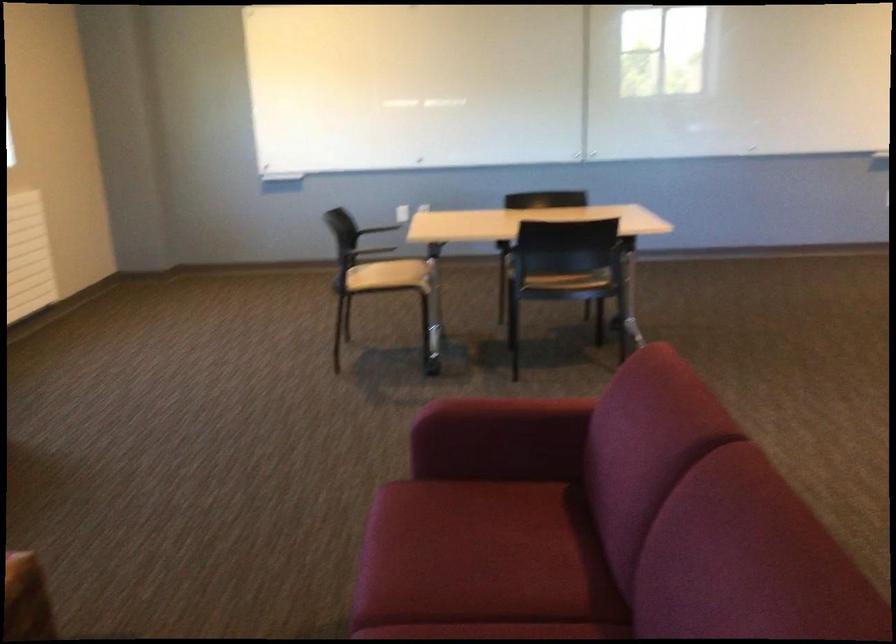
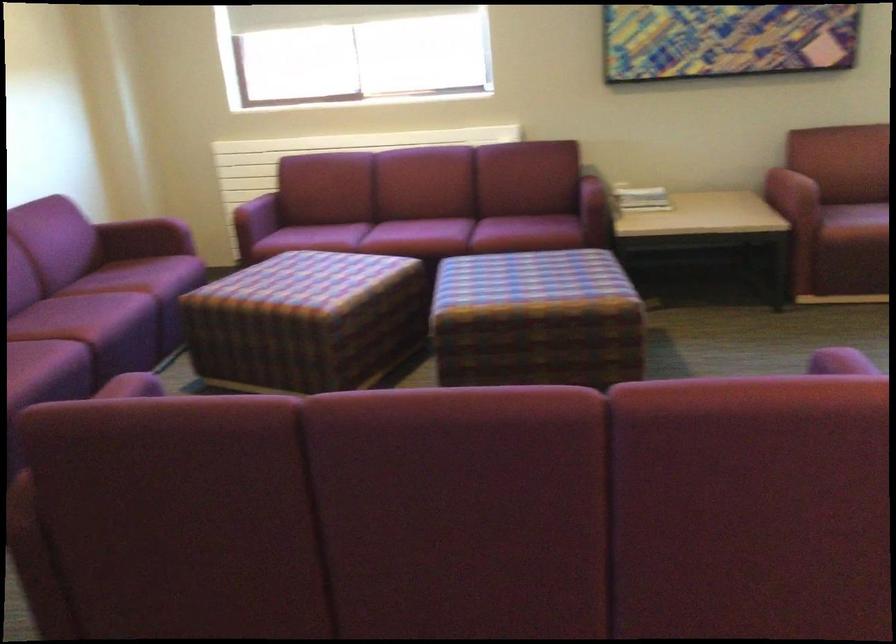
Where in the second image is the point corresponding to point 460,406 from the first image?

(840, 362)